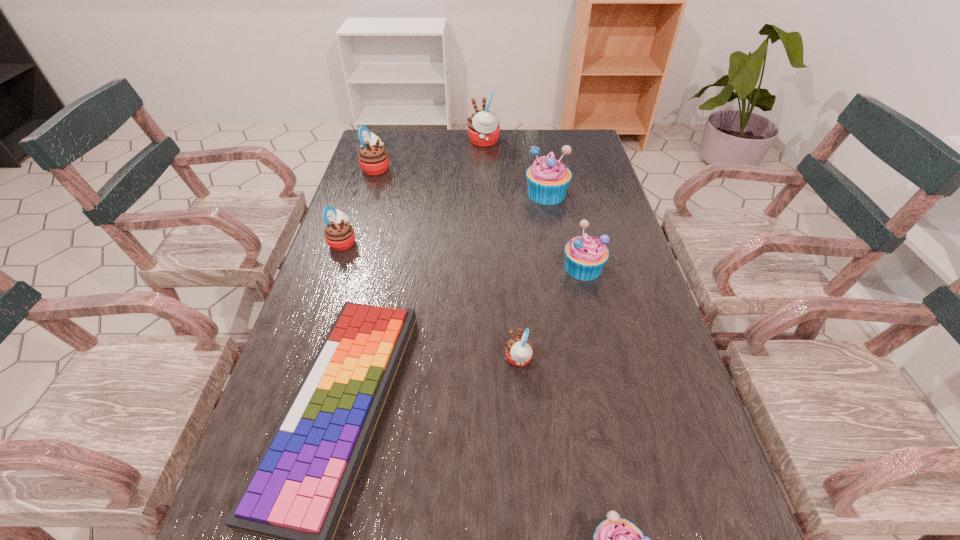
The height and width of the screenshot is (540, 960). Identify the location of the farthest pink muffin. (483, 126).

The image size is (960, 540). I want to click on the farthest muffin, so click(x=483, y=126).

Locate an element on the screen. Image resolution: width=960 pixels, height=540 pixels. the third nearest pink muffin is located at coordinates (373, 159).

Locate an element on the screen. The height and width of the screenshot is (540, 960). the second farthest muffin is located at coordinates (373, 159).

You are a GUI agent. You are given a task and a screenshot of the screen. Output one action in this format:
    pyautogui.click(x=<x>, y=<y>)
    Task: Click on the biggest blue muffin
    The image size is (960, 540).
    Given the screenshot: What is the action you would take?
    pyautogui.click(x=548, y=179)

Identify the location of the fifth nearest muffin. (548, 179).

Locate an element on the screen. the fourth farthest object is located at coordinates (339, 234).

Where is `the fourth farthest muffin`? The height and width of the screenshot is (540, 960). the fourth farthest muffin is located at coordinates (339, 234).

Where is `the fifth farthest object`? the fifth farthest object is located at coordinates click(585, 255).

This screenshot has height=540, width=960. Identify the location of the second farthest blue muffin. (585, 255).